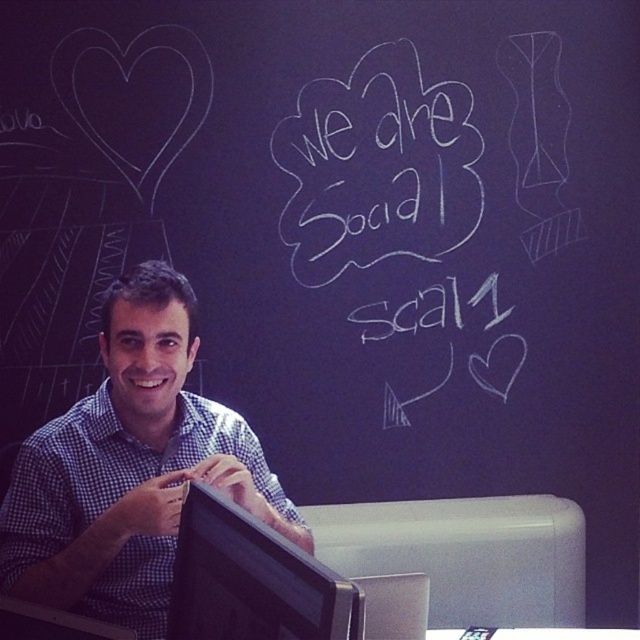
You are an office assistant who needs to locate the checkered fabric shirt at left and the black glossy monitor at center for a presentation. Which object is closer to the left edge of the desk?

The checkered fabric shirt at left is closer to the left edge of the desk since it is positioned on the left side of the black glossy monitor at center.

You are designing a poster for a school event and need to place two elements on a dark background. The first is a white chalk writing at upper center and the second is a black glossy monitor at center. Based on the image provided, which element has a greater width?

The white chalk writing at upper center has a greater width than the black glossy monitor at center.